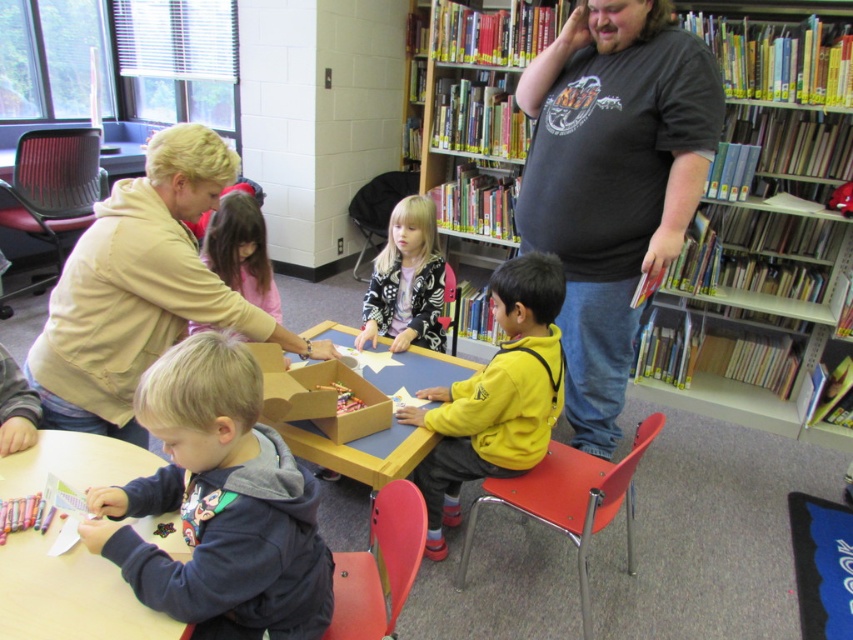
Can you confirm if smooth wooden table at lower left is bigger than blonde hair girl at center?

Correct, smooth wooden table at lower left is larger in size than blonde hair girl at center.

Can you confirm if smooth wooden table at lower left is smaller than blonde hair girl at center?

No.

Is point (16, 572) behind point (233, 230)?

No, (16, 572) is closer to viewer.

Identify the location of smooth wooden table at lower left. (68, 595).

Can you confirm if dark gray t-shirt at upper right is positioned above wooden table at center?

Yes, dark gray t-shirt at upper right is above wooden table at center.

Does point (544, 164) come closer to viewer compared to point (373, 467)?

That is False.

Identify the location of dark gray t-shirt at upper right. The height and width of the screenshot is (640, 853). (612, 180).

Who is lower down, dark blue fleece jacket at lower left or beige soft jacket at upper left?

dark blue fleece jacket at lower left

Can you confirm if dark blue fleece jacket at lower left is positioned below beige soft jacket at upper left?

Yes, dark blue fleece jacket at lower left is below beige soft jacket at upper left.

You are a GUI agent. You are given a task and a screenshot of the screen. Output one action in this format:
    pyautogui.click(x=<x>, y=<y>)
    Task: Click on the dark blue fleece jacket at lower left
    Image resolution: width=853 pixels, height=640 pixels.
    Given the screenshot: What is the action you would take?
    pyautogui.click(x=218, y=504)